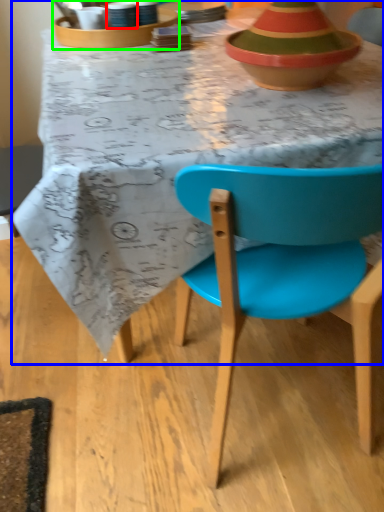
Question: Which object is positioned closest to tableware (highlighted by a red box)? Select from desk (highlighted by a blue box) and tableware (highlighted by a green box).

Choices:
 (A) desk
 (B) tableware

Answer: (B)